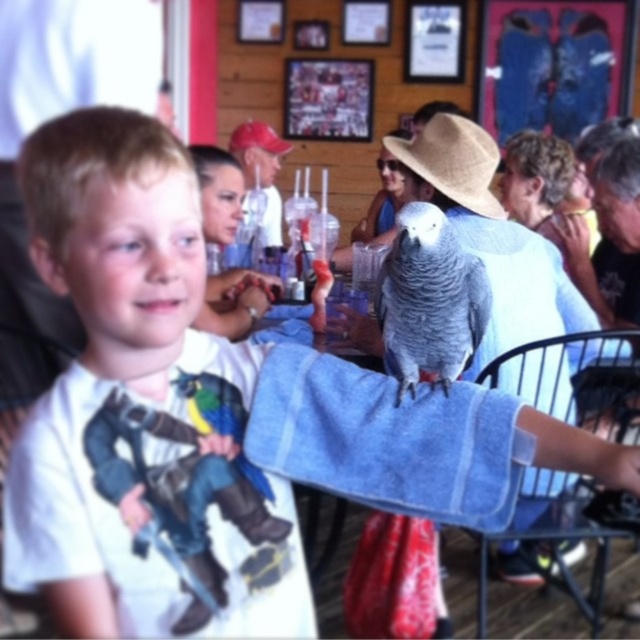
In the scene shown: Can you confirm if straw hat at center is positioned below multicolored feathered parrot at center?

Actually, straw hat at center is above multicolored feathered parrot at center.

Consider the image. Which of these two, straw hat at center or multicolored feathered parrot at center, stands taller?

straw hat at center is taller.

The image size is (640, 640). In order to click on straw hat at center in this screenshot , I will do `click(452, 161)`.

Consider the image. Is gray matte parrot at center further to camera compared to multicolored feathered parrot at center?

Yes.

Is gray matte parrot at center thinner than multicolored feathered parrot at center?

Incorrect, gray matte parrot at center's width is not less than multicolored feathered parrot at center's.

Is point (380, 276) more distant than point (216, 428)?

Yes.

You are a GUI agent. You are given a task and a screenshot of the screen. Output one action in this format:
    pyautogui.click(x=<x>, y=<y>)
    Task: Click on the gray matte parrot at center
    
    Given the screenshot: What is the action you would take?
    point(429,300)

Does straw hat at center lie behind straw hat at upper center?

No, it is not.

Is point (496, 148) in front of point (248, 131)?

Yes, point (496, 148) is closer to viewer.

What are the coordinates of `straw hat at center` in the screenshot? It's located at (452, 161).